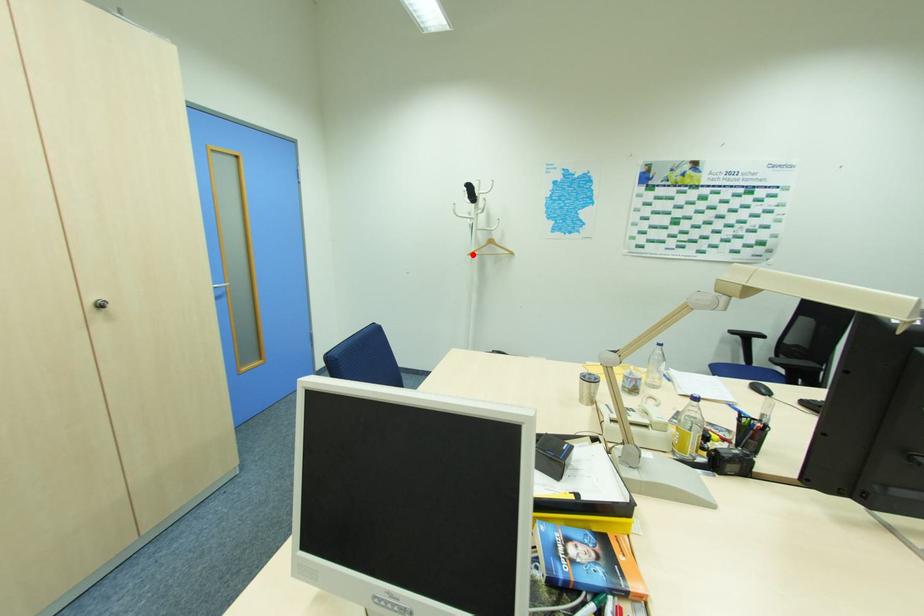
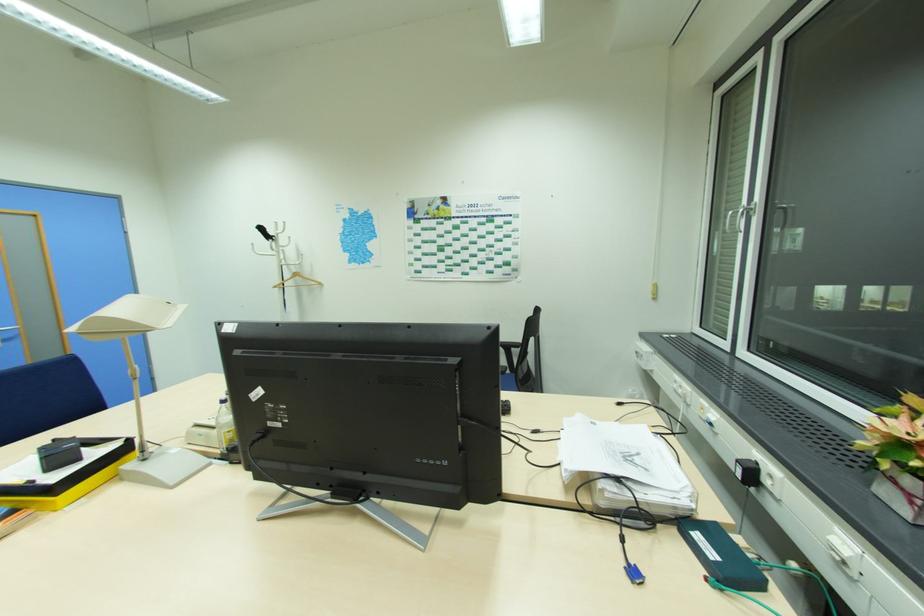
Locate, in the second image, the point that corresponds to the highlighted location in the first image.

(277, 286)